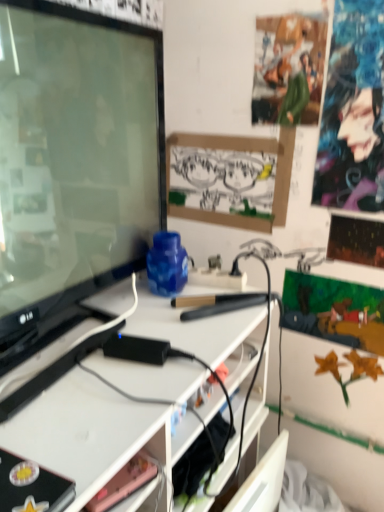
Where is `black paperboard at center`? black paperboard at center is located at coordinates (230, 179).

Where is `purple glossy poster at upper right`? This screenshot has width=384, height=512. purple glossy poster at upper right is located at coordinates (351, 133).

This screenshot has width=384, height=512. What do you see at coordinates (73, 164) in the screenshot?
I see `matte black tv at left` at bounding box center [73, 164].

The height and width of the screenshot is (512, 384). I want to click on black paperboard at center, so click(230, 179).

Does green fabric poster at upper center have a lesser width compared to matte black tv at left?

Yes.

Consider the image. Considering the sizes of objects green fabric poster at upper center and matte black tv at left in the image provided, who is smaller, green fabric poster at upper center or matte black tv at left?

With smaller size is green fabric poster at upper center.

From a real-world perspective, which object rests below the other?

matte black tv at left, from a real-world perspective.

In the image, there is a green fabric poster at upper center. Where is `television below it (from the image's perspective)`? television below it (from the image's perspective) is located at coordinates (73, 164).

How many degrees apart are the facing directions of pink matte phone at lower center and matte black book at lower left?

The angle between the facing direction of pink matte phone at lower center and the facing direction of matte black book at lower left is 17.4 degrees.

Is pink matte phone at lower center surrounding matte black book at lower left?

No, matte black book at lower left is not inside pink matte phone at lower center.

From a real-world perspective, is pink matte phone at lower center positioned under matte black book at lower left based on gravity?

Yes, from a real-world perspective, pink matte phone at lower center is beneath matte black book at lower left.

Where is `television located on the left of black paperboard at center`? This screenshot has height=512, width=384. television located on the left of black paperboard at center is located at coordinates (73, 164).

In the scene shown: Can you confirm if matte black tv at left is positioned to the right of black paperboard at center?

In fact, matte black tv at left is to the left of black paperboard at center.

Considering the sizes of objects matte black tv at left and black paperboard at center in the image provided, who is taller, matte black tv at left or black paperboard at center?

matte black tv at left.

Can you confirm if purple glossy poster at upper right is smaller than black paperboard at center?

Actually, purple glossy poster at upper right might be larger than black paperboard at center.

Can you confirm if purple glossy poster at upper right is shorter than black paperboard at center?

No.

Between purple glossy poster at upper right and black paperboard at center, which one is positioned behind?

black paperboard at center.

Is matte black book at lower left looking in the opposite direction of matte black tv at left?

No, matte black book at lower left is not facing the opposite direction of matte black tv at left.

Which point is more forward, (47, 475) or (100, 173)?

The point (47, 475) is in front.

Consider the image. Is matte black tv at left completely or partially inside matte black book at lower left?

No, matte black tv at left is not a part of matte black book at lower left.

Is matte black book at lower left wider than matte black tv at left?

Yes.

Is matte black book at lower left spatially inside purple glossy poster at upper right, or outside of it?

matte black book at lower left is spatially situated outside purple glossy poster at upper right.

Is matte black book at lower left turned away from purple glossy poster at upper right?

No.

Based on the photo, would you consider matte black book at lower left to be distant from purple glossy poster at upper right?

matte black book at lower left is far away from purple glossy poster at upper right.

Does matte black book at lower left appear on the left side of purple glossy poster at upper right?

Correct, you'll find matte black book at lower left to the left of purple glossy poster at upper right.

You are a GUI agent. You are given a task and a screenshot of the screen. Output one action in this format:
    pyautogui.click(x=<x>, y=<y>)
    Task: Click on the shelf that appears on the left of green fabric poster at upper center
    The width and height of the screenshot is (384, 512).
    Given the screenshot: What is the action you would take?
    pyautogui.click(x=124, y=482)

From the image's perspective, between pink matte phone at lower center and green fabric poster at upper center, who is located below?

pink matte phone at lower center, from the image's perspective.

Based on the photo, which object is further away from the camera, pink matte phone at lower center or green fabric poster at upper center?

Positioned behind is green fabric poster at upper center.

Which of these two, pink matte phone at lower center or green fabric poster at upper center, is wider?

pink matte phone at lower center is wider.

Locate an element on the screen. This screenshot has height=512, width=384. television on the left of green fabric poster at upper center is located at coordinates (73, 164).

In order to click on shelf on the right of the matte black book at lower left in this screenshot , I will do point(124,482).

Based on their spatial positions, is matte black tv at left or pink matte phone at lower center closer to green fabric poster at upper center?

matte black tv at left is positioned closer to the anchor green fabric poster at upper center.

Considering their positions, is black paperboard at center positioned further to pink matte phone at lower center than matte black tv at left?

black paperboard at center lies further to pink matte phone at lower center than the other object.

Estimate the real-world distances between objects in this image. Which object is closer to black paperboard at center, pink matte phone at lower center or green fabric poster at upper center?

The object closer to black paperboard at center is green fabric poster at upper center.

Estimate the real-world distances between objects in this image. Which object is further from green fabric poster at upper center, matte black book at lower left or matte black tv at left?

Based on the image, matte black book at lower left appears to be further to green fabric poster at upper center.

When comparing their distances from green fabric poster at upper center, does matte black tv at left or purple glossy poster at upper right seem further?

The object further to green fabric poster at upper center is matte black tv at left.

From the image, which object appears to be farther from black paperboard at center, purple glossy poster at upper right or green fabric poster at upper center?

Based on the image, purple glossy poster at upper right appears to be further to black paperboard at center.

Considering their positions, is matte black book at lower left positioned closer to green fabric poster at upper center than pink matte phone at lower center?

pink matte phone at lower center is closer to green fabric poster at upper center.

Based on their spatial positions, is pink matte phone at lower center or matte black book at lower left closer to black paperboard at center?

Among the two, pink matte phone at lower center is located nearer to black paperboard at center.

Where is `poster located between matte black book at lower left and black paperboard at center in the depth direction`? poster located between matte black book at lower left and black paperboard at center in the depth direction is located at coordinates (288, 69).

Locate an element on the screen. This screenshot has width=384, height=512. person positioned between matte black tv at left and black paperboard at center from near to far is located at coordinates (351, 133).

Identify the location of poster between matte black tv at left and black paperboard at center in the front-back direction. This screenshot has width=384, height=512. (288, 69).

The height and width of the screenshot is (512, 384). I want to click on poster between matte black tv at left and purple glossy poster at upper right in the horizontal direction, so click(x=288, y=69).